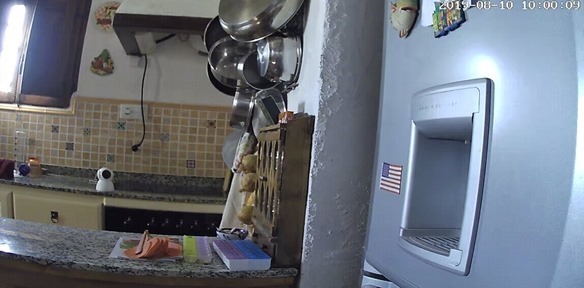
Where is `window that lets in sunlight`? window that lets in sunlight is located at coordinates (6, 58).